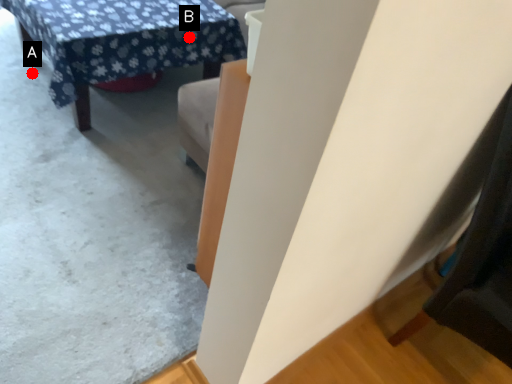
Question: Two points are circled on the image, labeled by A and B beside each circle. Which of the following is the closest to the observer?

Choices:
 (A) A is closer
 (B) B is closer

Answer: (B)